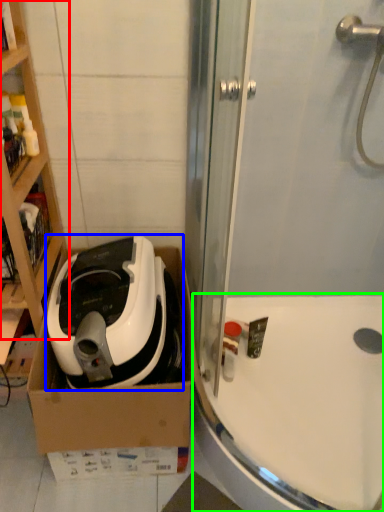
Question: Which is farther away from cabinetry (highlighted by a red box)? home appliance (highlighted by a blue box) or bath (highlighted by a green box)?

Choices:
 (A) home appliance
 (B) bath

Answer: (B)